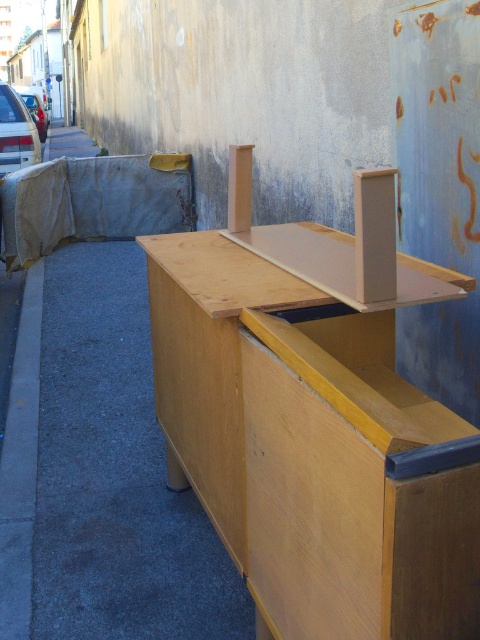
You are moving a 36 inch wide painting. You need to place it between the light brown wood table at center and the wooden bench at right. Can the painting fit in the space between them?

The distance between the light brown wood table at center and the wooden bench at right is 35.10 inches. Since the painting is 36 inches wide, it cannot fit in the space between them.

You are setting up a small outdoor dining area and have a light brown wood table at center and a wooden bench at right. Which object should you move first to create space for a new chair?

The wooden bench at right should be moved first because the light brown wood table at center is to the right of it, meaning the bench is closer to the left side and moving it would free up space for the new chair.

You are standing in front of the partially disassembled wooden structure. There are two points marked on the structure. The first point is at coordinates point (268, 336) and the second is at point (117, 259). From your perspective, which point is closer to you?

Point (268, 336) is in front of point (117, 259), so it is closer to you.